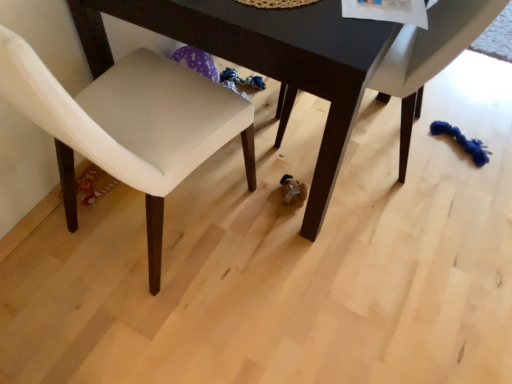
Where is `empty space that is to the right of white fabric chair at lower right, which is the 1th chair in right-to-left order`? This screenshot has height=384, width=512. empty space that is to the right of white fabric chair at lower right, which is the 1th chair in right-to-left order is located at coordinates (466, 133).